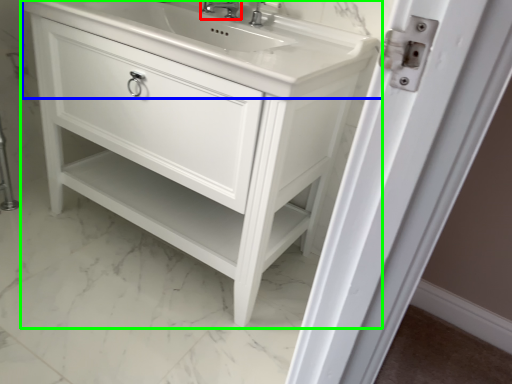
Question: Estimate the real-world distances between objects in this image. Which object is closer to tap (highlighted by a red box), counter top (highlighted by a blue box) or bathroom cabinet (highlighted by a green box)?

Choices:
 (A) counter top
 (B) bathroom cabinet

Answer: (A)